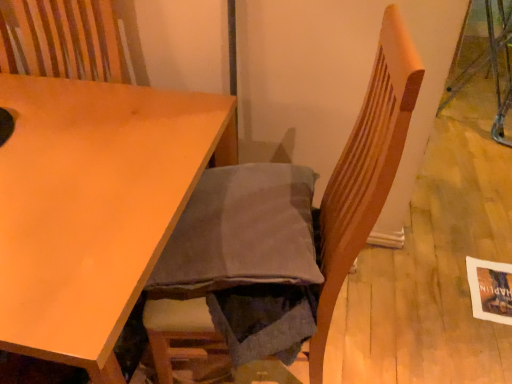
This screenshot has width=512, height=384. In order to click on free point to the right of wooden chair at center in this screenshot , I will do `click(386, 328)`.